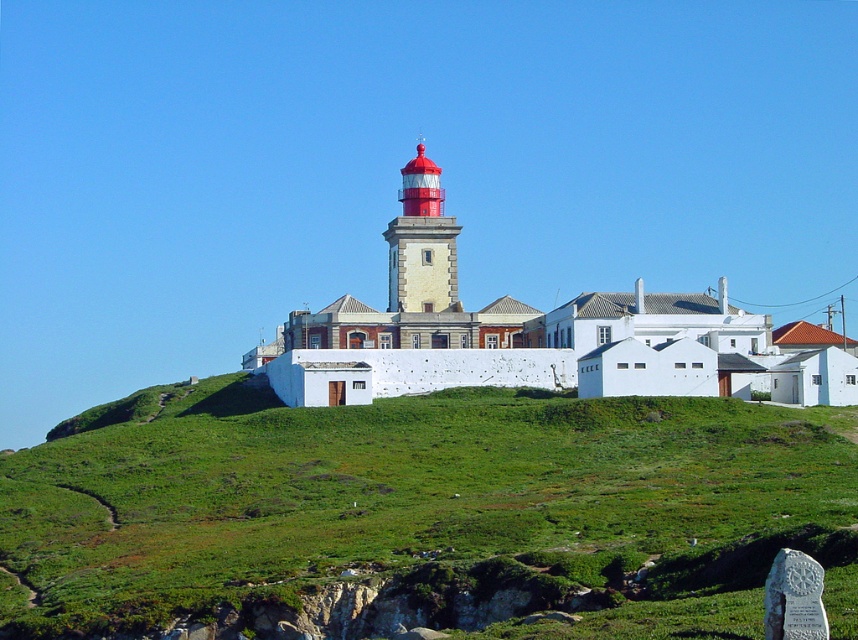
In the scene shown: You are standing at the coast looking at the scene. Which object, the green grassy hillside at center or the smooth red lighthouse at center, is closer to you?

The green grassy hillside at center is closer to the viewer than the smooth red lighthouse at center.

You are standing at the base of the lighthouse and want to reach the point marked by point (x=343, y=520). There is an obstacle at point (x=403, y=216). Will you encounter the obstacle on your way?

Point (x=343, y=520) is in front of point (x=403, y=216), so you will not encounter the obstacle at point (x=403, y=216) on your way to point (x=343, y=520).

You are standing at the base of the lighthouse in the image and want to reach the point marked at coordinates (214, 572). Given that the distance between you and this point is 78.94 meters, can you estimate how far you need to walk to reach it?

The point at coordinates (214, 572) is 78.94 meters away from your current position at the base of the lighthouse, so you need to walk approximately 78.94 meters to reach it.